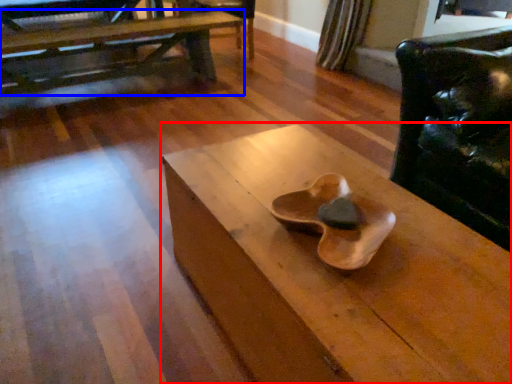
Question: Which object appears closest to the camera in this image, table (highlighted by a red box) or table (highlighted by a blue box)?

Choices:
 (A) table
 (B) table

Answer: (A)